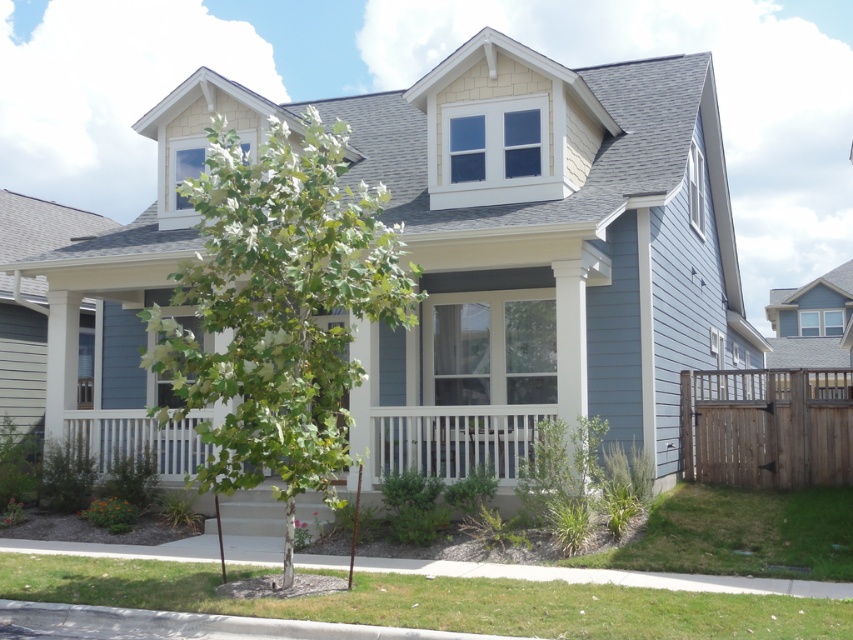
Question: Observing the image, what is the correct spatial positioning of green leafy tree at center in reference to brown wooden fence at right?

Choices:
 (A) above
 (B) below

Answer: (A)

Question: Among these objects, which one is nearest to the camera?

Choices:
 (A) green leafy tree at center
 (B) brown wooden fence at right

Answer: (A)

Question: Which point is closer to the camera taking this photo?

Choices:
 (A) (161, 340)
 (B) (764, 371)

Answer: (A)

Question: Which object is farther from the camera taking this photo?

Choices:
 (A) green leafy tree at center
 (B) brown wooden fence at right

Answer: (B)

Question: Is green leafy tree at center thinner than brown wooden fence at right?

Choices:
 (A) yes
 (B) no

Answer: (B)

Question: Considering the relative positions of green leafy tree at center and brown wooden fence at right in the image provided, where is green leafy tree at center located with respect to brown wooden fence at right?

Choices:
 (A) below
 (B) above

Answer: (B)